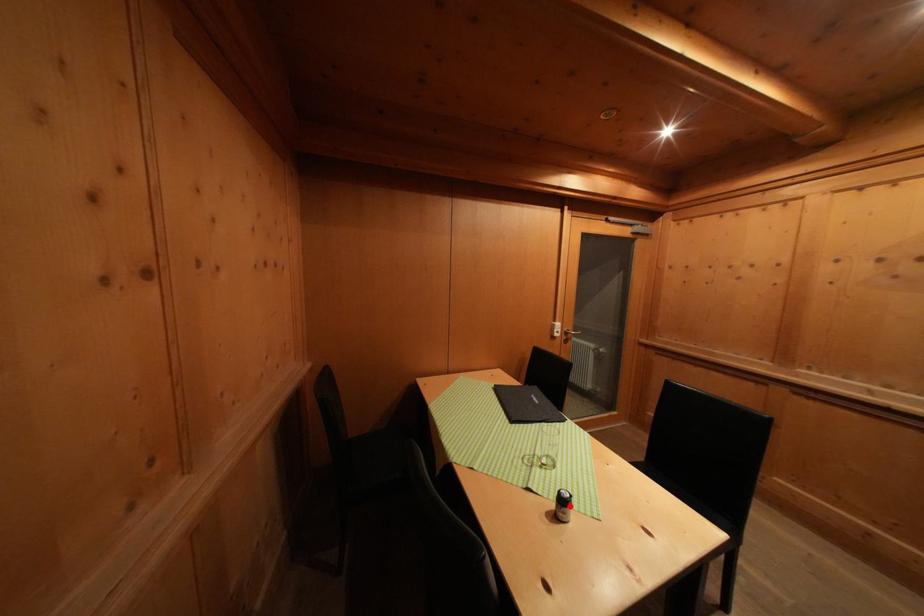
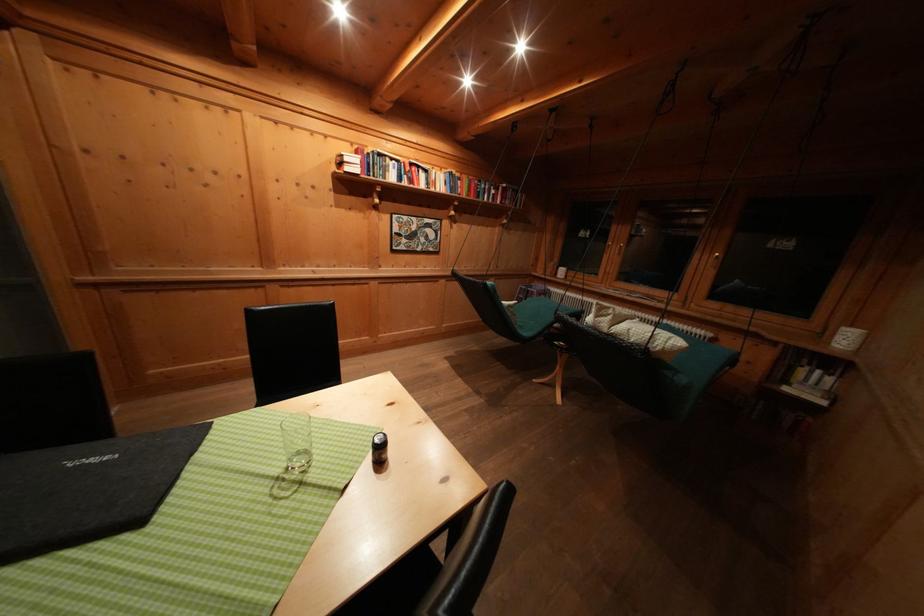
Find the pixel in the second image that matches the highlighted location in the first image.

(388, 448)